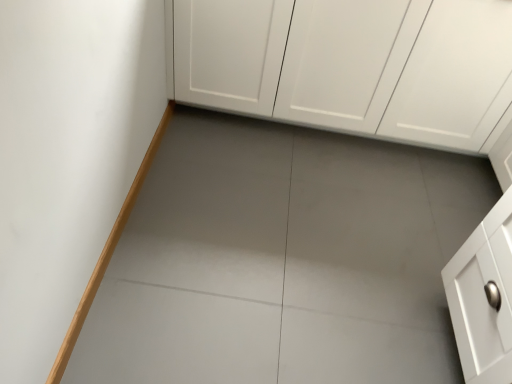
The width and height of the screenshot is (512, 384). Describe the element at coordinates (351, 65) in the screenshot. I see `white matte cabinet at upper center` at that location.

You are a GUI agent. You are given a task and a screenshot of the screen. Output one action in this format:
    pyautogui.click(x=<x>, y=<y>)
    Task: Click on the white matte cabinet at upper center
    Image resolution: width=512 pixels, height=384 pixels.
    Given the screenshot: What is the action you would take?
    pyautogui.click(x=351, y=65)

Locate an element on the screen. white matte cabinet at upper center is located at coordinates (351, 65).